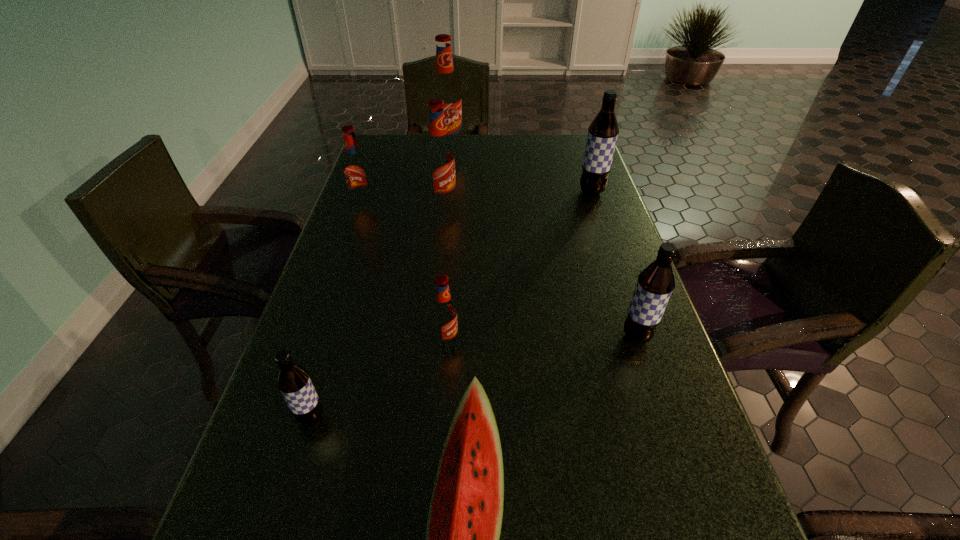
Locate an element on the screen. The height and width of the screenshot is (540, 960). the biggest red root beer is located at coordinates (445, 87).

Where is `the tallest root beer`? Image resolution: width=960 pixels, height=540 pixels. the tallest root beer is located at coordinates (445, 87).

Where is `the second biggest red root beer`? The width and height of the screenshot is (960, 540). the second biggest red root beer is located at coordinates (x=439, y=157).

Find the location of `the biggest brown root beer`. the biggest brown root beer is located at coordinates coord(603,131).

Find the location of a particular element. This screenshot has width=960, height=540. the leftmost red root beer is located at coordinates (356, 170).

Locate an element on the screen. the second farthest brown root beer is located at coordinates (655, 284).

The width and height of the screenshot is (960, 540). What are the coordinates of `the smallest red root beer` in the screenshot? It's located at 444,313.

Locate an element on the screen. the nearest root beer is located at coordinates coord(293,381).

This screenshot has width=960, height=540. I want to click on the smallest brown root beer, so click(x=293, y=381).

Where is `free spot located on the front of the farthest object`? The width and height of the screenshot is (960, 540). free spot located on the front of the farthest object is located at coordinates (441, 221).